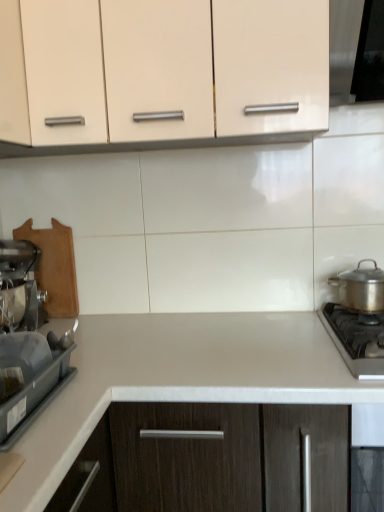
Question: Should I look upward or downward to see stainless steel gas stove at lower right?

Choices:
 (A) down
 (B) up

Answer: (A)

Question: Considering the relative sizes of metallic silver mixer at left, arranged as the second kitchen appliance when viewed from the right, and white laminate countertop at center in the image provided, is metallic silver mixer at left, arranged as the second kitchen appliance when viewed from the right, shorter than white laminate countertop at center?

Choices:
 (A) yes
 (B) no

Answer: (A)

Question: Does metallic silver mixer at left, the first kitchen appliance when ordered from left to right, come behind white laminate countertop at center?

Choices:
 (A) yes
 (B) no

Answer: (A)

Question: Can you confirm if metallic silver mixer at left, the first kitchen appliance when ordered from left to right, is wider than white laminate countertop at center?

Choices:
 (A) no
 (B) yes

Answer: (A)

Question: Can you confirm if metallic silver mixer at left, the first kitchen appliance when ordered from left to right, is taller than white laminate countertop at center?

Choices:
 (A) no
 (B) yes

Answer: (A)

Question: From the image's perspective, is metallic silver mixer at left, arranged as the second kitchen appliance when viewed from the right, on top of white laminate countertop at center?

Choices:
 (A) yes
 (B) no

Answer: (A)

Question: From the image's perspective, does metallic silver mixer at left, the first kitchen appliance when ordered from left to right, appear lower than white laminate countertop at center?

Choices:
 (A) no
 (B) yes

Answer: (A)

Question: Could you tell me if matte cream cabinet at upper center is facing white laminate countertop at center?

Choices:
 (A) no
 (B) yes

Answer: (A)

Question: Is matte cream cabinet at upper center turned away from white laminate countertop at center?

Choices:
 (A) yes
 (B) no

Answer: (B)

Question: Is matte cream cabinet at upper center outside of white laminate countertop at center?

Choices:
 (A) no
 (B) yes

Answer: (B)

Question: Does matte cream cabinet at upper center appear on the left side of white laminate countertop at center?

Choices:
 (A) no
 (B) yes

Answer: (B)

Question: From a real-world perspective, is matte cream cabinet at upper center positioned over white laminate countertop at center based on gravity?

Choices:
 (A) yes
 (B) no

Answer: (A)

Question: Would you say white laminate countertop at center is part of matte cream cabinet at upper center's contents?

Choices:
 (A) yes
 (B) no

Answer: (B)

Question: Does satin silver pot at right, the 1th kitchen appliance positioned from the right, have a smaller size compared to stainless steel gas stove at lower right?

Choices:
 (A) no
 (B) yes

Answer: (B)